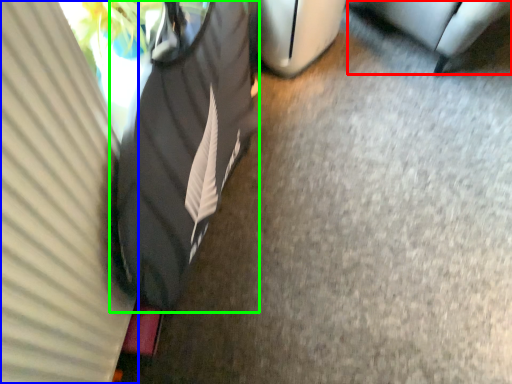
Question: Which object is positioned farthest from furniture (highlighted by a red box)? Select from curtain (highlighted by a blue box) and bean bag chair (highlighted by a green box).

Choices:
 (A) curtain
 (B) bean bag chair

Answer: (A)